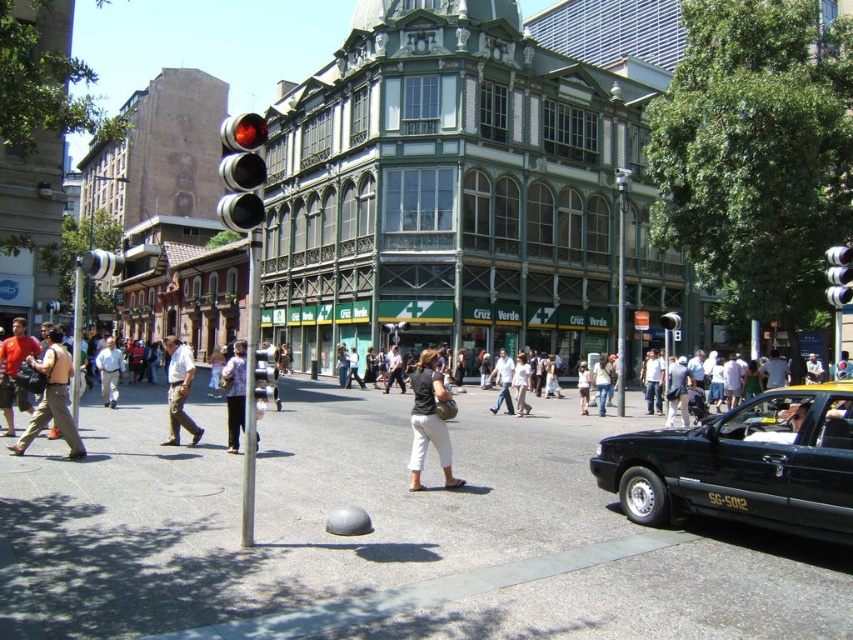
Between matte black top at center and metallic silver traffic light at upper right, which one has less height?

With less height is metallic silver traffic light at upper right.

Where is `matte black top at center`? This screenshot has height=640, width=853. matte black top at center is located at coordinates (428, 420).

At what (x,y) coordinates should I click in order to perform the action: click on matte black top at center. Please return your answer as a coordinate pair (x, y). This screenshot has width=853, height=640. Looking at the image, I should click on (428, 420).

Is metallic pole at left thinner than light brown leather jacket at center?

No, metallic pole at left is not thinner than light brown leather jacket at center.

Which of these two, metallic pole at left or light brown leather jacket at center, stands taller?

Standing taller between the two is metallic pole at left.

Describe the element at coordinates (76, 339) in the screenshot. This screenshot has height=640, width=853. I see `metallic pole at left` at that location.

The width and height of the screenshot is (853, 640). In order to click on metallic pole at left in this screenshot , I will do `click(76, 339)`.

The height and width of the screenshot is (640, 853). What do you see at coordinates (428, 420) in the screenshot?
I see `matte black top at center` at bounding box center [428, 420].

Based on the photo, is matte black top at center positioned at the back of matte khaki pants at left?

No, it is in front of matte khaki pants at left.

Who is more distant from viewer, (425, 412) or (68, 458)?

Point (68, 458)

Image resolution: width=853 pixels, height=640 pixels. Find the location of `matte black top at center`. matte black top at center is located at coordinates (428, 420).